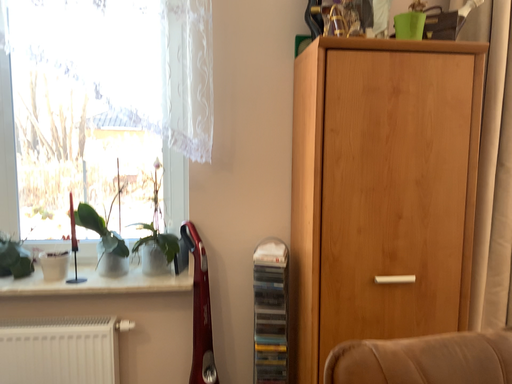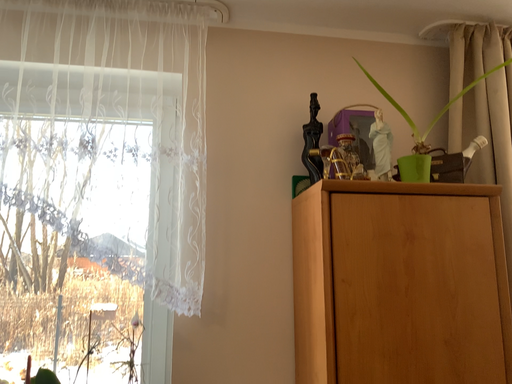
Question: How did the camera likely rotate when shooting the video?

Choices:
 (A) rotated downward
 (B) rotated upward

Answer: (B)